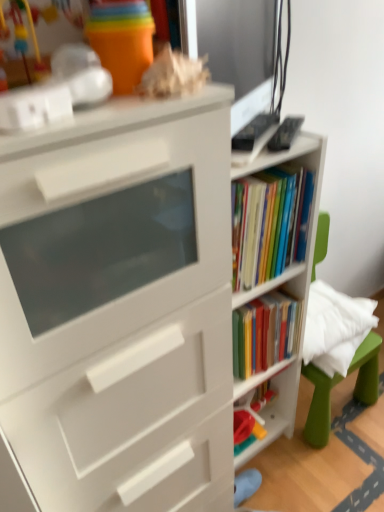
This screenshot has height=512, width=384. In order to click on free spot to the right of white matte bookshelf at center, the 2th shelf ordered from the bottom in this screenshot , I will do `click(324, 465)`.